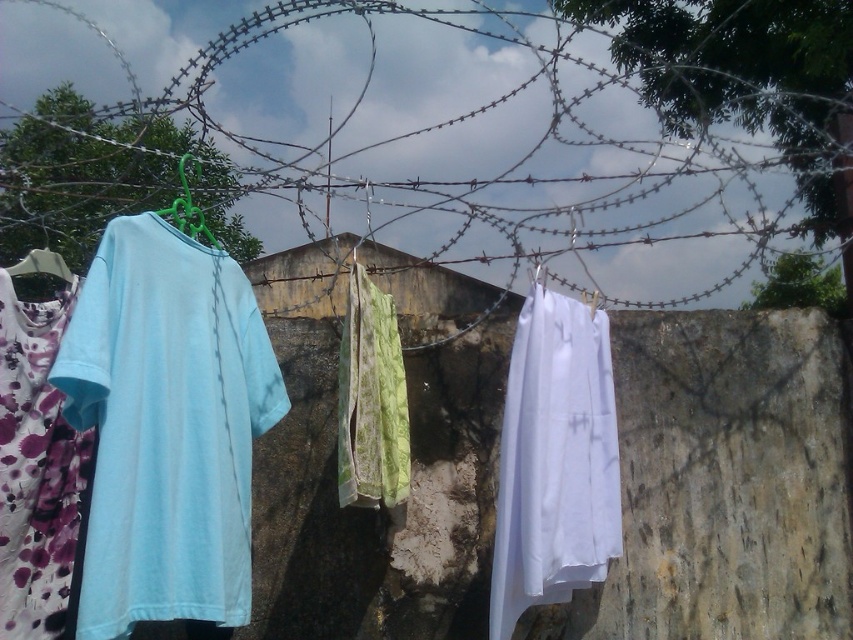
Which is in front, point (595, 436) or point (24, 266)?

Positioned in front is point (24, 266).

In the scene shown: Is white matte cloth at center further to camera compared to matte plastic hanger at left?

Yes, white matte cloth at center is further from the viewer.

Is point (614, 442) positioned after point (51, 256)?

Yes, it is behind point (51, 256).

Locate an element on the screen. The image size is (853, 640). white matte cloth at center is located at coordinates (554, 460).

Is light blue cotton t-shirt at left taller than green plastic hanger at upper left?

Correct, light blue cotton t-shirt at left is much taller as green plastic hanger at upper left.

Is light blue cotton t-shirt at left smaller than green plastic hanger at upper left?

No.

Is point (105, 577) closer to viewer compared to point (192, 211)?

Yes, point (105, 577) is closer to viewer.

You are a GUI agent. You are given a task and a screenshot of the screen. Output one action in this format:
    pyautogui.click(x=<x>, y=<y>)
    Task: Click on the light blue cotton t-shirt at left
    This screenshot has height=640, width=853.
    Given the screenshot: What is the action you would take?
    pyautogui.click(x=167, y=428)

Who is taller, rusty wire at center or green textured fabric at center?

With more height is rusty wire at center.

Describe the element at coordinates (444, 132) in the screenshot. I see `rusty wire at center` at that location.

The height and width of the screenshot is (640, 853). Describe the element at coordinates (444, 132) in the screenshot. I see `rusty wire at center` at that location.

Where is `rusty wire at center`? Image resolution: width=853 pixels, height=640 pixels. rusty wire at center is located at coordinates click(444, 132).